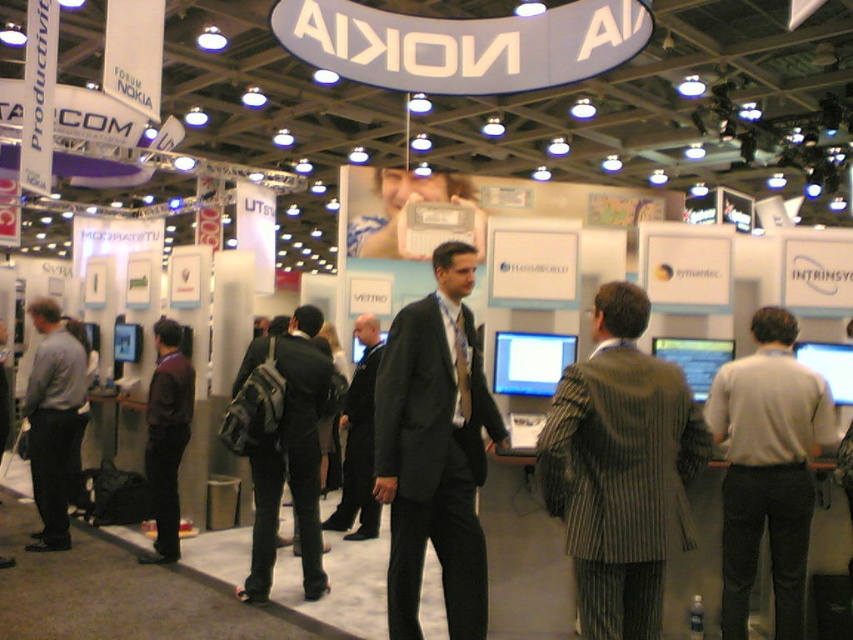
Who is higher up, striped wool suit at center or gray wool sweater at right?

striped wool suit at center

Who is lower down, striped wool suit at center or gray wool sweater at right?

gray wool sweater at right is below.

Is point (555, 516) positioned behind point (804, 474)?

No, (555, 516) is in front of (804, 474).

This screenshot has width=853, height=640. What are the coordinates of `striped wool suit at center` in the screenshot? It's located at (619, 468).

Between gray wool sweater at right and matte gray shirt at left, which one has more height?

Standing taller between the two is matte gray shirt at left.

Does gray wool sweater at right have a larger size compared to matte gray shirt at left?

No.

Between point (759, 314) and point (67, 387), which one is positioned behind?

The point (67, 387) is behind.

Locate an element on the screen. The width and height of the screenshot is (853, 640). gray wool sweater at right is located at coordinates (767, 468).

Based on the photo, who is more distant from viewer, (672, 435) or (352, 512)?

The point (352, 512) is behind.

How far apart are striped wool suit at center and black suit at center?

striped wool suit at center and black suit at center are 10.36 feet apart from each other.

Between point (581, 547) and point (367, 433), which one is positioned in front?

Point (581, 547) is in front.

The image size is (853, 640). Identify the location of striped wool suit at center. (619, 468).